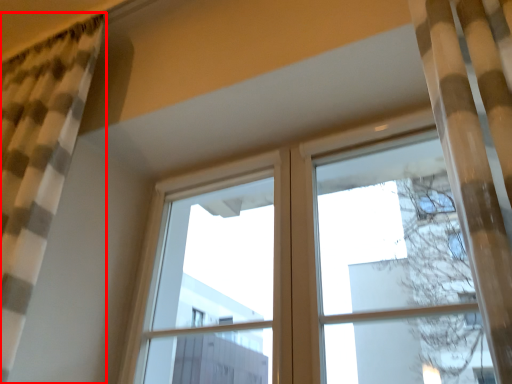
Question: Where is curtain (annotated by the red box) located in relation to window frame in the image?

Choices:
 (A) left
 (B) right

Answer: (A)